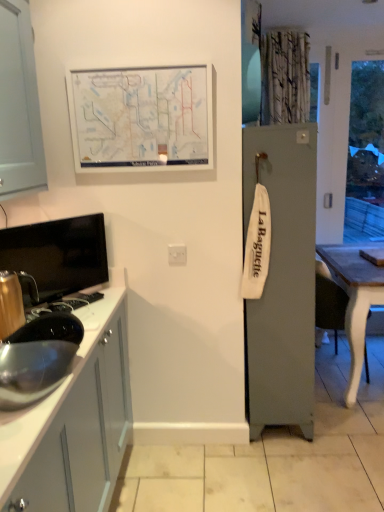
Question: Is the depth of satin silver sink at lower left less than that of metallic gold kettle at left?

Choices:
 (A) no
 (B) yes

Answer: (A)

Question: Is satin silver sink at lower left taller than metallic gold kettle at left?

Choices:
 (A) yes
 (B) no

Answer: (A)

Question: Are satin silver sink at lower left and metallic gold kettle at left beside each other?

Choices:
 (A) yes
 (B) no

Answer: (B)

Question: Is the depth of satin silver sink at lower left greater than that of metallic gold kettle at left?

Choices:
 (A) no
 (B) yes

Answer: (B)

Question: Is metallic gold kettle at left surrounded by satin silver sink at lower left?

Choices:
 (A) yes
 (B) no

Answer: (B)

Question: From the image's perspective, is satin silver sink at lower left on metallic gold kettle at left?

Choices:
 (A) yes
 (B) no

Answer: (A)

Question: Can you confirm if white matte map at upper center is smaller than white plastic electric outlet at center?

Choices:
 (A) yes
 (B) no

Answer: (B)

Question: Can we say white matte map at upper center lies outside white plastic electric outlet at center?

Choices:
 (A) no
 (B) yes

Answer: (B)

Question: Is white matte map at upper center surrounding white plastic electric outlet at center?

Choices:
 (A) yes
 (B) no

Answer: (B)

Question: From the image's perspective, is white matte map at upper center located above white plastic electric outlet at center?

Choices:
 (A) yes
 (B) no

Answer: (A)

Question: Considering the relative sizes of white matte map at upper center and white plastic electric outlet at center in the image provided, is white matte map at upper center bigger than white plastic electric outlet at center?

Choices:
 (A) no
 (B) yes

Answer: (B)

Question: Is white matte map at upper center in contact with white plastic electric outlet at center?

Choices:
 (A) no
 (B) yes

Answer: (A)

Question: From a real-world perspective, is satin silver sink at lower left positioned over white matte map at upper center based on gravity?

Choices:
 (A) yes
 (B) no

Answer: (B)